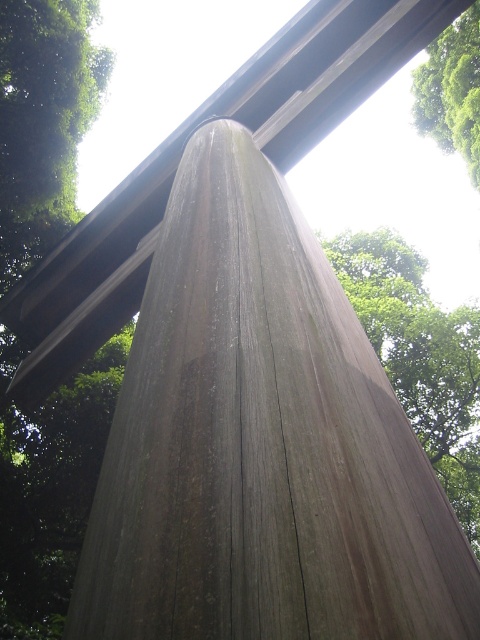
You are standing in a garden and see the weathered wood pillar at center and the green leafy tree at upper right. Which object is closer to you?

The weathered wood pillar at center is closer to you because it is in front of the green leafy tree at upper right.

You are designing a garden layout and need to place a decorative item between the weathered wood pillar at center and the green leafy tree at upper right. Given their widths, which object should the item be placed closer to?

The decorative item should be placed closer to the weathered wood pillar at center because its width is narrower than the green leafy tree at upper right.